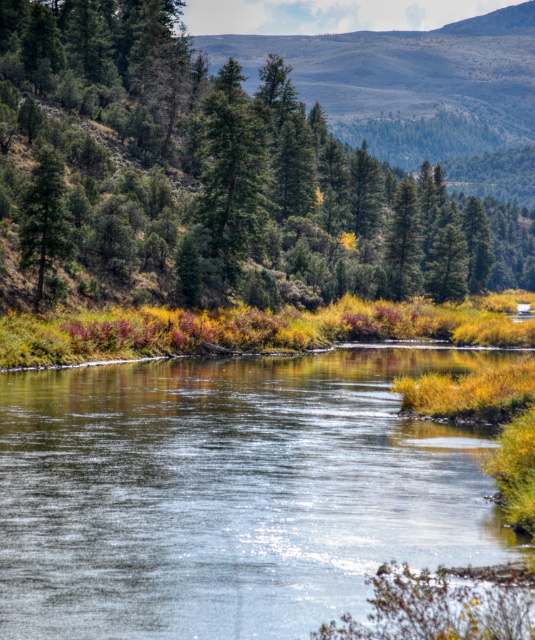
Question: Can you confirm if green matte tree at upper center is thinner than green matte tree at left?

Choices:
 (A) yes
 (B) no

Answer: (B)

Question: Which point is farther from the camera taking this photo?

Choices:
 (A) (25, 195)
 (B) (508, 193)

Answer: (B)

Question: Which object appears closest to the camera in this image?

Choices:
 (A) green matte tree at left
 (B) clear water at center

Answer: (B)

Question: Does green matte tree at upper center lie behind green matte tree at left?

Choices:
 (A) no
 (B) yes

Answer: (B)

Question: Is the position of green matte tree at upper center more distant than that of green matte tree at left?

Choices:
 (A) yes
 (B) no

Answer: (A)

Question: Which point appears farthest from the camera in this image?

Choices:
 (A) (29, 512)
 (B) (22, 195)
 (C) (457, 243)

Answer: (C)